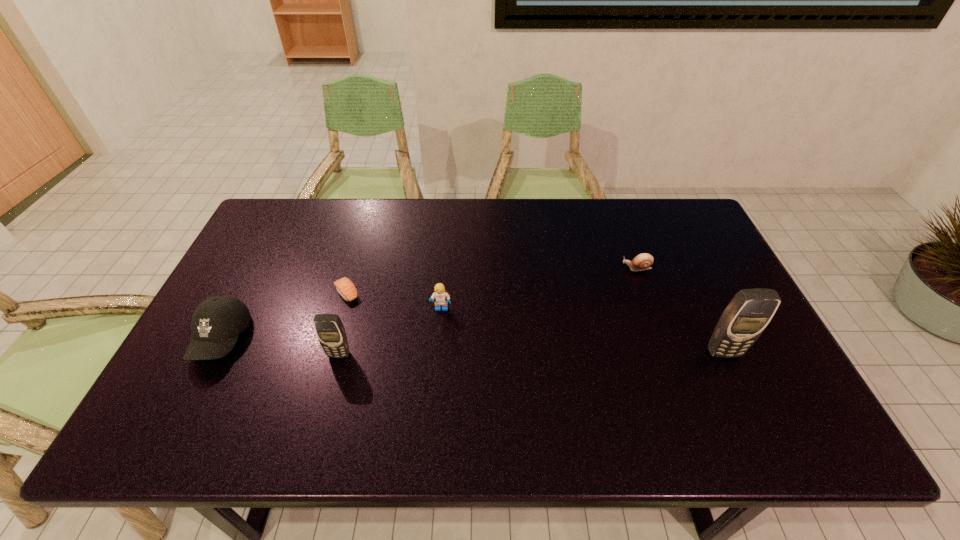
Find the location of a particular element. object located in the near left corner section of the desktop is located at coordinates (217, 322).

You are a GUI agent. You are given a task and a screenshot of the screen. Output one action in this format:
    pyautogui.click(x=<x>, y=<y>)
    Task: Click on the vacant region at the far edge of the desktop
    The width and height of the screenshot is (960, 540).
    Given the screenshot: What is the action you would take?
    pyautogui.click(x=328, y=206)

In the image, there is a desktop. Identify the location of free space at the near edge. The height and width of the screenshot is (540, 960). (542, 381).

The height and width of the screenshot is (540, 960). Identify the location of free space at the right edge of the desktop. (701, 260).

I want to click on free space at the near left corner of the desktop, so click(167, 386).

Identify the location of free space at the far right corner of the desktop. This screenshot has height=540, width=960. (705, 233).

In the image, there is a desktop. Find the location of `vacant space at the near right corner`. vacant space at the near right corner is located at coordinates (768, 404).

Find the location of a particular element. vacant area between the leftmost object and the sushi is located at coordinates (284, 316).

Find the location of `empty space between the second tallest object and the third object from right to left`. empty space between the second tallest object and the third object from right to left is located at coordinates click(391, 332).

Where is `vacant space that's between the tallest object and the left cellular telephone`? The height and width of the screenshot is (540, 960). vacant space that's between the tallest object and the left cellular telephone is located at coordinates (531, 354).